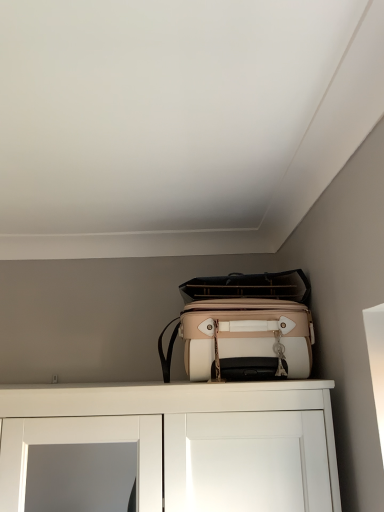
Locate an element on the screen. pale pink leather suitcase at center is located at coordinates (244, 328).

Describe the element at coordinates (244, 328) in the screenshot. I see `pale pink leather suitcase at center` at that location.

What is the approximate height of pale pink leather suitcase at center?

pale pink leather suitcase at center is 7.71 inches in height.

The width and height of the screenshot is (384, 512). Find the location of `pale pink leather suitcase at center`. pale pink leather suitcase at center is located at coordinates (244, 328).